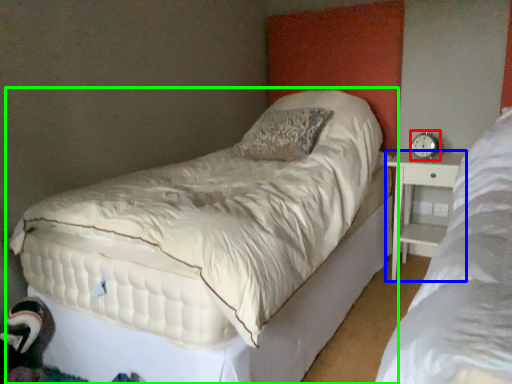
Question: Estimate the real-world distances between objects in this image. Which object is farther from alarm clock (highlighted by a red box), nightstand (highlighted by a blue box) or bed (highlighted by a green box)?

Choices:
 (A) nightstand
 (B) bed

Answer: (B)